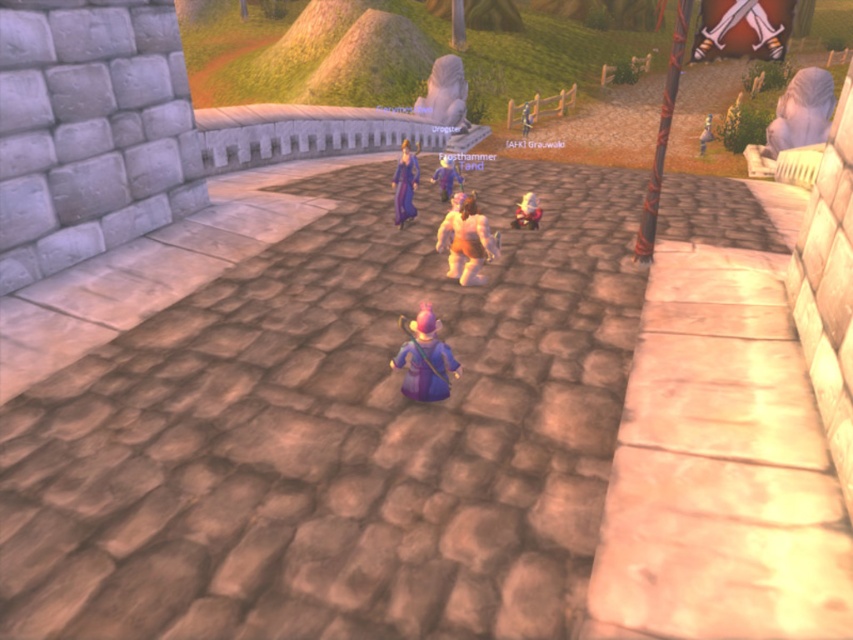
Question: Can you confirm if purple velvet robe at center is positioned to the right of shiny metallic figurine at center?

Choices:
 (A) no
 (B) yes

Answer: (A)

Question: Which object appears closest to the camera in this image?

Choices:
 (A) purple velvet robe at center
 (B) shiny metallic figurine at center

Answer: (A)

Question: Does purple velvet staff at center appear on the right side of purple velvet robe at center?

Choices:
 (A) no
 (B) yes

Answer: (B)

Question: Does purple velvet robe at center appear on the left side of shiny metallic figurine at center?

Choices:
 (A) yes
 (B) no

Answer: (A)

Question: Among these objects, which one is farthest from the camera?

Choices:
 (A) shiny purple toy at center
 (B) purple velvet robe at center
 (C) purple velvet staff at center

Answer: (A)

Question: Which of these objects is positioned closest to the orange fur-like creature at center?

Choices:
 (A) purple velvet staff at center
 (B) shiny purple toy at center
 (C) shiny metallic figurine at center
 (D) purple velvet robe at center

Answer: (C)